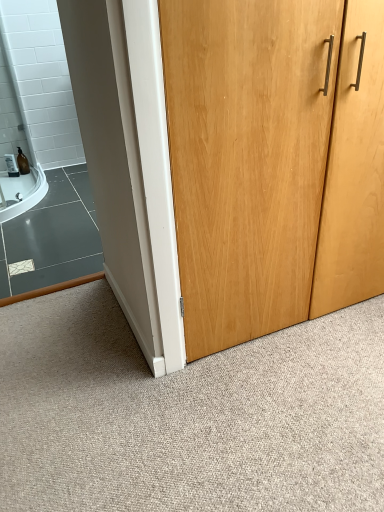
Question: From a real-world perspective, is natural wood door at center physically located above or below light brown wood door at center?

Choices:
 (A) above
 (B) below

Answer: (B)

Question: Is natural wood door at center in front of or behind light brown wood door at center in the image?

Choices:
 (A) behind
 (B) front

Answer: (B)

Question: From the image's perspective, is natural wood door at center above or below light brown wood door at center?

Choices:
 (A) below
 (B) above

Answer: (A)

Question: Is light brown wood door at center taller or shorter than natural wood door at center?

Choices:
 (A) short
 (B) tall

Answer: (B)

Question: Is light brown wood door at center wider or thinner than natural wood door at center?

Choices:
 (A) thin
 (B) wide

Answer: (A)

Question: Is light brown wood door at center to the left or to the right of natural wood door at center in the image?

Choices:
 (A) left
 (B) right

Answer: (B)

Question: Is light brown wood door at center inside or outside of natural wood door at center?

Choices:
 (A) inside
 (B) outside

Answer: (B)